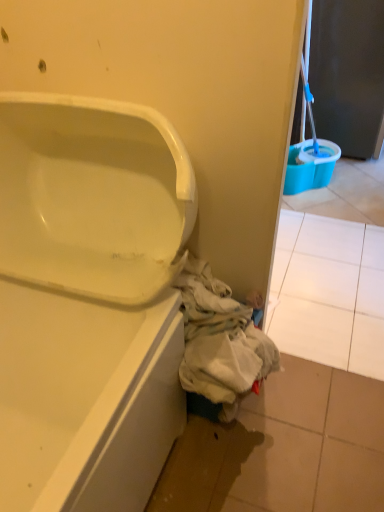
Question: Considering the relative positions of matte black screen door at upper right and white tile at lower right in the image provided, is matte black screen door at upper right to the right of white tile at lower right from the viewer's perspective?

Choices:
 (A) yes
 (B) no

Answer: (A)

Question: Is matte black screen door at upper right facing towards white tile at lower right?

Choices:
 (A) yes
 (B) no

Answer: (B)

Question: Is matte black screen door at upper right turned away from white tile at lower right?

Choices:
 (A) no
 (B) yes

Answer: (A)

Question: Can you confirm if matte black screen door at upper right is positioned to the left of white tile at lower right?

Choices:
 (A) no
 (B) yes

Answer: (A)

Question: Would you say matte black screen door at upper right is a long distance from white tile at lower right?

Choices:
 (A) no
 (B) yes

Answer: (B)

Question: In terms of size, does white glossy bathtub at lower left appear bigger or smaller than white fabric at lower right?

Choices:
 (A) big
 (B) small

Answer: (A)

Question: From the image's perspective, is white glossy bathtub at lower left located above or below white fabric at lower right?

Choices:
 (A) below
 (B) above

Answer: (A)

Question: Considering the positions of point (114, 102) and point (210, 303), is point (114, 102) closer or farther from the camera than point (210, 303)?

Choices:
 (A) farther
 (B) closer

Answer: (B)

Question: From a real-world perspective, is white glossy bathtub at lower left physically located above or below white fabric at lower right?

Choices:
 (A) below
 (B) above

Answer: (B)

Question: Is matte black screen door at upper right wider or thinner than white tile at lower right?

Choices:
 (A) thin
 (B) wide

Answer: (A)

Question: In terms of size, does matte black screen door at upper right appear bigger or smaller than white tile at lower right?

Choices:
 (A) big
 (B) small

Answer: (A)

Question: Visually, is matte black screen door at upper right positioned to the left or to the right of white tile at lower right?

Choices:
 (A) left
 (B) right

Answer: (B)

Question: Would you say matte black screen door at upper right is inside or outside white tile at lower right?

Choices:
 (A) outside
 (B) inside

Answer: (A)

Question: From the image's perspective, is white tile at lower right positioned above or below white glossy bathtub at lower left?

Choices:
 (A) below
 (B) above

Answer: (B)

Question: Considering the positions of point (344, 258) and point (163, 117), is point (344, 258) closer or farther from the camera than point (163, 117)?

Choices:
 (A) farther
 (B) closer

Answer: (A)